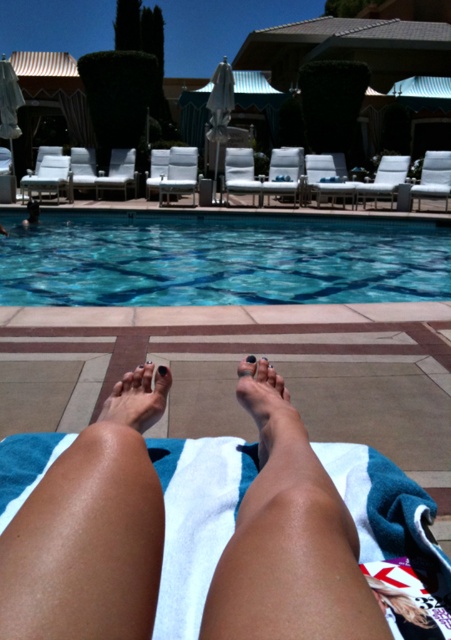
You are a lifeguard at the pool and need to ensure safety. You observe two people in the scene described. One has nail polish matte foot at lower center and the other has nail polish painted toenail at center. Which person has a larger foot size?

The person with the nail polish matte foot at lower center has a larger foot size compared to the nail polish painted toenail at center.

You are standing at the edge of the pool and see two points marked in the scene. Which point is closer to you, point (247, 410) or point (137, 380)?

Point (247, 410) is in front of point (137, 380), so it is closer to you.

You are standing at the edge of the pool and want to locate the blue glassy water at center. Which coordinates should you look towards?

You should look towards coordinates point (x=220, y=259) to find the blue glassy water at center.